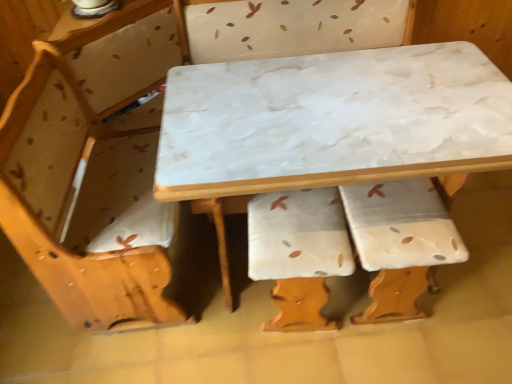
At what (x,y) coordinates should I click in order to perform the action: click on blank space above white marble tablecloth at center (from a real-world perspective). Please return your answer as a coordinate pair (x, y). The height and width of the screenshot is (384, 512). Looking at the image, I should click on (323, 112).